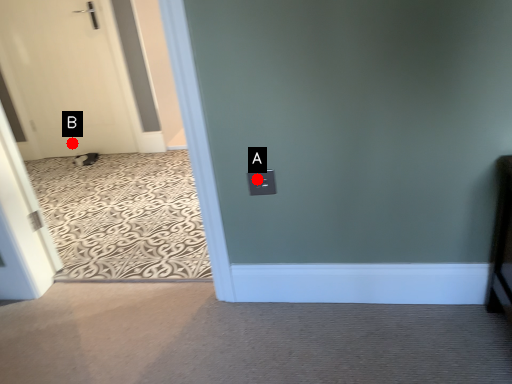
Question: Two points are circled on the image, labeled by A and B beside each circle. Which point appears farthest from the camera in this image?

Choices:
 (A) A is further
 (B) B is further

Answer: (B)